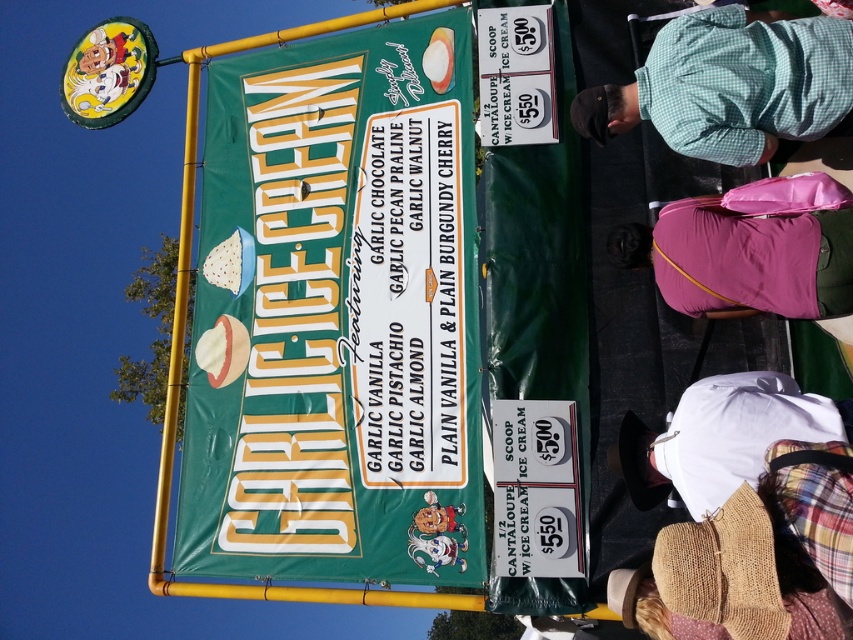
You are standing in front of the Garlic Ice Cream banner and want to read the flavor names. Given that the average human can read text from 10 meters away, will you be able to read the flavor names on the green fabric banner at upper center from your current position?

The green fabric banner at upper center is 21.54 meters away from the viewer, which is more than twice the average reading distance of 10 meters. Therefore, you will not be able to read the flavor names clearly from your current position.